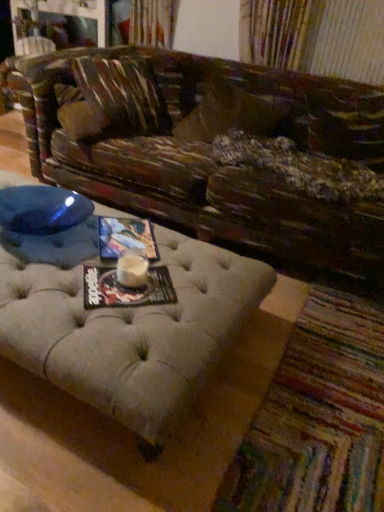
You are a GUI agent. You are given a task and a screenshot of the screen. Output one action in this format:
    pyautogui.click(x=<x>, y=<y>)
    Task: Click on the free space to the left of beige tufted ottoman at lower center
    This screenshot has width=384, height=512.
    Given the screenshot: What is the action you would take?
    pyautogui.click(x=191, y=407)